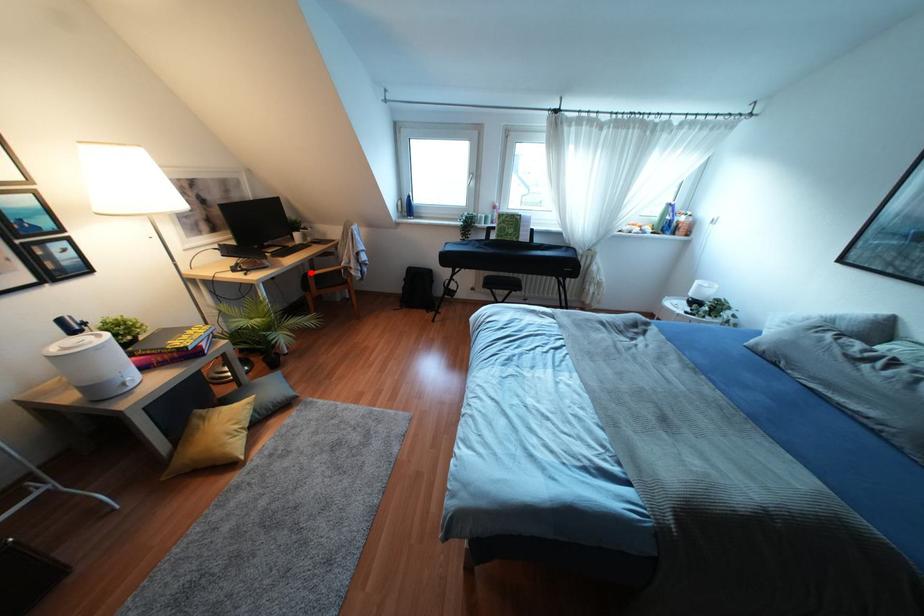
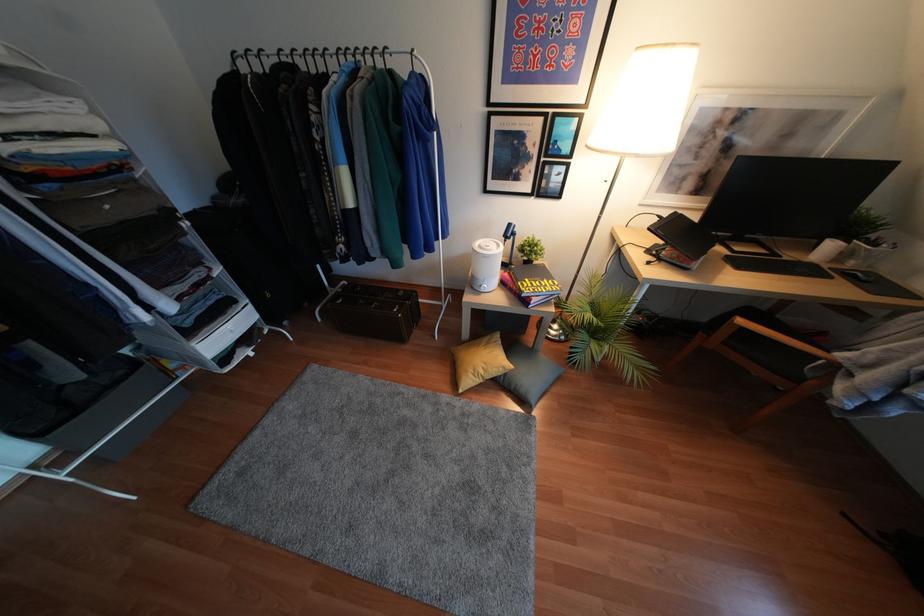
Where in the second image is the point corresponding to the highlighted location from the first image?

(739, 321)